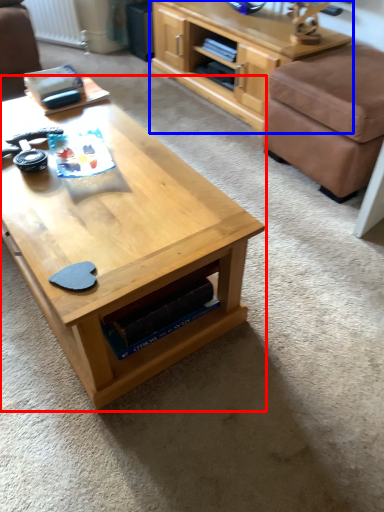
Question: Which of the following is the closest to the observer, coffee table (highlighted by a red box) or shelf (highlighted by a blue box)?

Choices:
 (A) coffee table
 (B) shelf

Answer: (A)